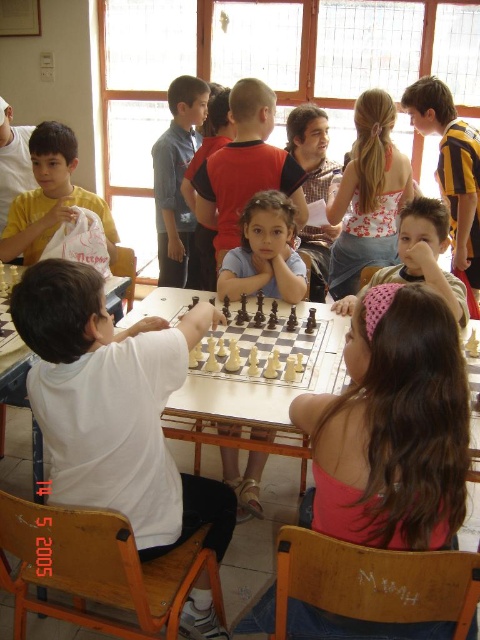
Question: Among these points, which one is farthest from the camera?

Choices:
 (A) (448, 301)
 (B) (81, 205)
 (C) (192, 481)

Answer: (B)

Question: Can you confirm if white matte shirt at center is positioned below blue cotton shirt at center?

Choices:
 (A) no
 (B) yes

Answer: (B)

Question: Can you confirm if white plastic chess set at center is positioned below matte white bag at left?

Choices:
 (A) yes
 (B) no

Answer: (A)

Question: Which point is closer to the camera taking this photo?

Choices:
 (A) (95, 202)
 (B) (156, 486)
 (C) (407, 204)
 (D) (272, 312)

Answer: (B)

Question: Among these points, which one is farthest from the camera?

Choices:
 (A) (229, 509)
 (B) (415, 269)

Answer: (B)

Question: Is blue cotton shirt at center below white plastic chess set at center?

Choices:
 (A) no
 (B) yes

Answer: (A)